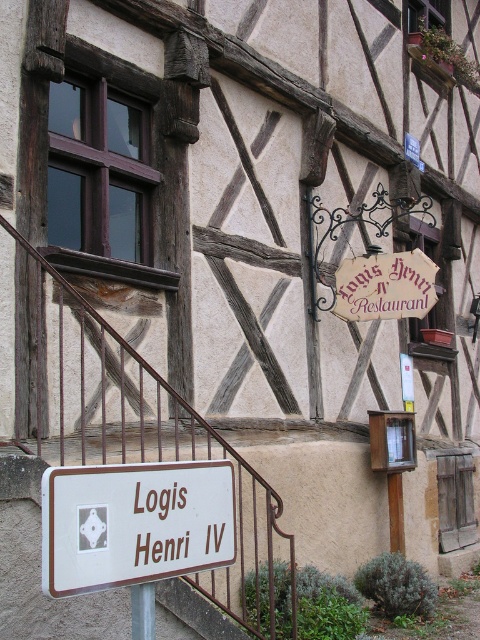
At what (x,y) coordinates should I click in order to perform the action: click on wooden sign at center-right. Please return your answer as a coordinate pair (x, y). The image size is (480, 640). Looking at the image, I should click on (384, 285).

Between wooden sign at center-right and silver metallic pole at lower center, which one has less height?

silver metallic pole at lower center

Locate an element on the screen. wooden sign at center-right is located at coordinates (384, 285).

Who is more distant from viewer, (84, 456) or (351, 310)?

The point (351, 310) is more distant.

Does point (295, 593) come behind point (375, 284)?

No, it is not.

Where is `brown metal/rail at lower left`? This screenshot has width=480, height=640. brown metal/rail at lower left is located at coordinates (133, 429).

From the picture: Does brown metal/rail at lower left have a greater height compared to silver metallic pole at lower center?

Yes.

From the picture: Between brown metal/rail at lower left and silver metallic pole at lower center, which one appears on the left side from the viewer's perspective?

brown metal/rail at lower left is more to the left.

Image resolution: width=480 pixels, height=640 pixels. What do you see at coordinates (133, 429) in the screenshot?
I see `brown metal/rail at lower left` at bounding box center [133, 429].

Locate an element on the screen. This screenshot has height=640, width=480. brown metal/rail at lower left is located at coordinates point(133,429).